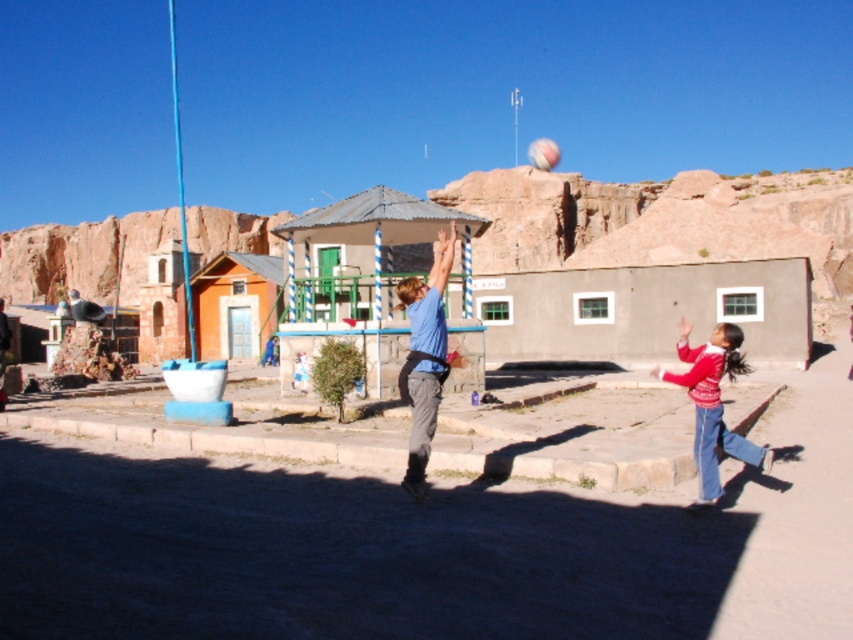
You are a photographer trying to capture a photo of both the blue matte shirt at center and the red sweater at lower right in the same frame. Based on their heights, which person should you position closer to the camera to ensure both appear equally tall in the photo?

Since the blue matte shirt at center is much taller than the red sweater at lower right, you should position the red sweater at lower right closer to the camera to make them appear the same height in the photo.

Based on the photo, you are standing in the outdoor area and want to hand a ball to both the blue matte shirt at center and the red sweater at lower right. Which person should you approach first to ensure you can reach them without moving closer?

You should approach the blue matte shirt at center first because it is closer to you than the red sweater at lower right, so you can reach them without needing to move closer.